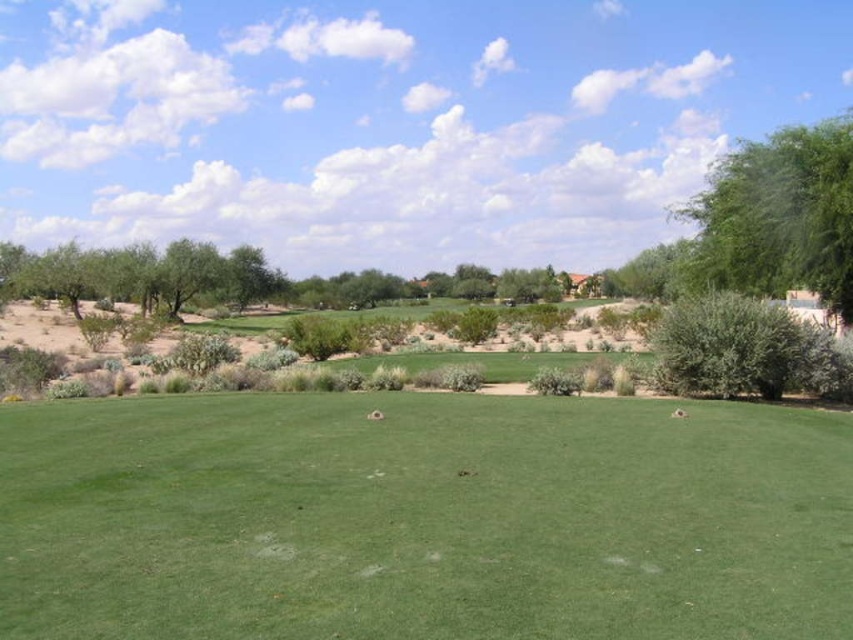
Is green smooth grass at center wider than green leafy tree at upper right?

In fact, green smooth grass at center might be narrower than green leafy tree at upper right.

Who is taller, green smooth grass at center or green leafy tree at upper right?

With more height is green leafy tree at upper right.

Does point (537, 592) come farther from viewer compared to point (728, 211)?

No, it is in front of (728, 211).

Find the location of a particular element. Image resolution: width=853 pixels, height=640 pixels. green smooth grass at center is located at coordinates (422, 518).

Is green leafy tree at left to the right of green leafy tree at center from the viewer's perspective?

Incorrect, green leafy tree at left is not on the right side of green leafy tree at center.

Is point (173, 266) closer to viewer compared to point (268, 264)?

Yes, it is in front of point (268, 264).

I want to click on green leafy tree at left, so click(x=142, y=275).

Can you confirm if green smooth grass at center is positioned above green leafy tree at center?

Incorrect, green smooth grass at center is not positioned above green leafy tree at center.

Who is more forward, (837, 556) or (253, 289)?

Point (837, 556) is more forward.

The height and width of the screenshot is (640, 853). What do you see at coordinates (422, 518) in the screenshot? I see `green smooth grass at center` at bounding box center [422, 518].

Image resolution: width=853 pixels, height=640 pixels. Identify the location of green smooth grass at center. (422, 518).